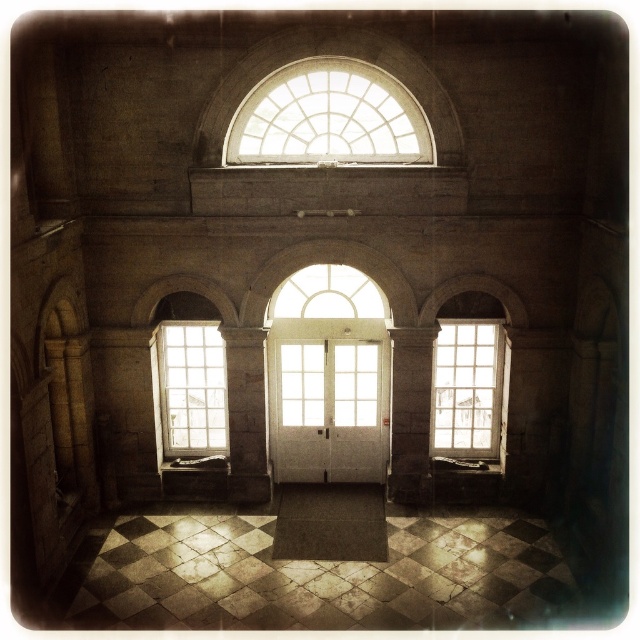
You are standing in the grand building and want to know how far you are from the point marked at coordinates point (296, 72). Can you determine the distance?

The distance between you and the point (296, 72) is 12.95 meters.

You are an architect examining the building. You notice the clear glass dome at upper center and the clear glass window at center. Which of these two objects is closer to the entrance of the building?

The clear glass dome at upper center is closer to the entrance because it is in front of the clear glass window at center.